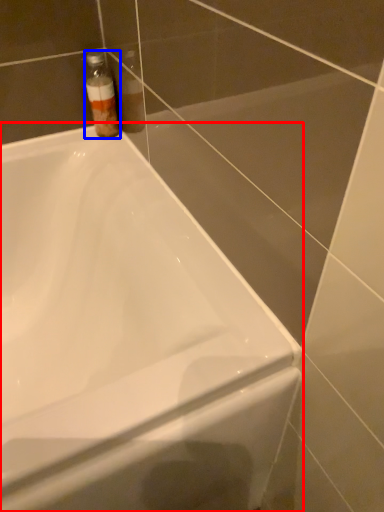
Question: Which point is closer to the camera, bathtub (highlighted by a red box) or bottle (highlighted by a blue box)?

Choices:
 (A) bathtub
 (B) bottle

Answer: (A)